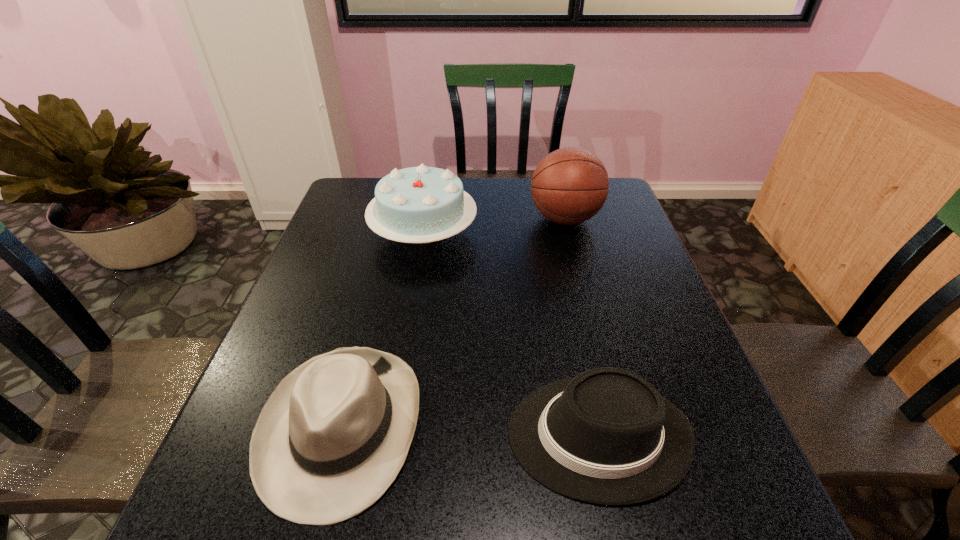
Identify the location of basketball. The height and width of the screenshot is (540, 960). (569, 186).

Identify the location of birthday cake. (422, 204).

Image resolution: width=960 pixels, height=540 pixels. I want to click on the left fedora, so click(x=330, y=440).

At what (x,y) coordinates should I click in order to perform the action: click on the right fedora. Please return your answer as a coordinate pair (x, y). This screenshot has width=960, height=540. Looking at the image, I should click on (607, 436).

Identify the location of free space located on the back of the basketball. (555, 180).

I want to click on blank area located 0.310m on the right of the birthday cake, so click(x=584, y=233).

Find the location of a particular element. The image size is (960, 540). vacant space situated on the front-facing side of the right fedora is located at coordinates (416, 435).

Locate an element on the screen. The image size is (960, 540). free space located on the front-facing side of the right fedora is located at coordinates (454, 435).

Where is `free location located 0.310m on the front-facing side of the right fedora`? Image resolution: width=960 pixels, height=540 pixels. free location located 0.310m on the front-facing side of the right fedora is located at coordinates pos(339,435).

This screenshot has width=960, height=540. I want to click on basketball located in the far edge section of the desktop, so click(x=569, y=186).